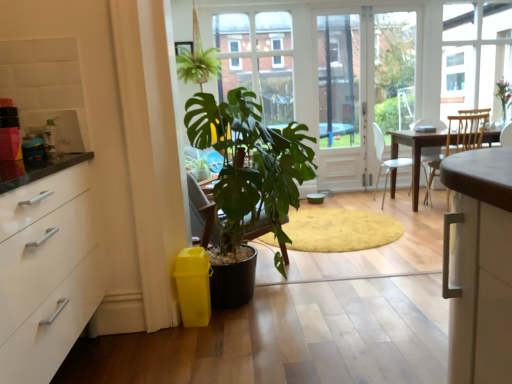
Question: Considering the positions of metallic silver kettle at upper left and transparent glass screen door at center in the image, is metallic silver kettle at upper left taller or shorter than transparent glass screen door at center?

Choices:
 (A) short
 (B) tall

Answer: (A)

Question: From a real-world perspective, relative to transparent glass screen door at center, is metallic silver kettle at upper left vertically above or below?

Choices:
 (A) below
 (B) above

Answer: (A)

Question: Which of these objects is positioned closest to the transparent glass screen door at center?

Choices:
 (A) white plastic chair at center
 (B) green matte plant at center
 (C) metallic silver kettle at upper left
 (D) green leafy plant at center

Answer: (A)

Question: Based on their relative distances, which object is nearer to the white plastic chair at center?

Choices:
 (A) metallic silver kettle at upper left
 (B) green matte plant at center
 (C) transparent glass screen door at center
 (D) green leafy plant at center

Answer: (C)